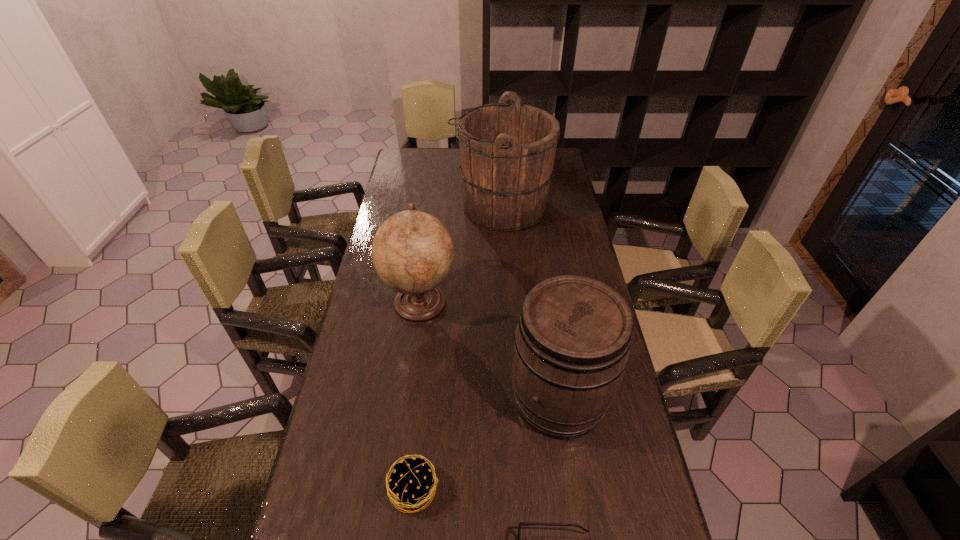
This screenshot has width=960, height=540. I want to click on vacant space that is in between the second farthest object and the tallest object, so click(x=461, y=254).

You are a GUI agent. You are given a task and a screenshot of the screen. Output one action in this format:
    pyautogui.click(x=<x>, y=<y>)
    Task: Click on the unoccupied position between the wine bucket and the fourth tallest object
    Image resolution: width=960 pixels, height=540 pixels.
    Given the screenshot: What is the action you would take?
    pyautogui.click(x=487, y=444)

The width and height of the screenshot is (960, 540). I want to click on the third closest object to the bucket, so click(412, 483).

Find the location of a particular element. object that ranks as the third closest to the third nearest object is located at coordinates (520, 523).

Locate an element on the screen. The width and height of the screenshot is (960, 540). vacant space that satisfies the following two spatial constraints: 1. on the front-facing side of the second shortest object; 2. on the right side of the globe is located at coordinates (396, 490).

Identify the location of free point that satisfies the following two spatial constraints: 1. on the front-facing side of the fourth nearest object; 2. on the right side of the third farthest object. The height and width of the screenshot is (540, 960). (407, 398).

You are a GUI agent. You are given a task and a screenshot of the screen. Output one action in this format:
    pyautogui.click(x=<x>, y=<y>)
    Task: Click on the vacant space that satisfies the following two spatial constraints: 1. on the back side of the second nearest object; 2. on the front-facing side of the globe
    Image resolution: width=960 pixels, height=540 pixels.
    Given the screenshot: What is the action you would take?
    pyautogui.click(x=433, y=301)

The height and width of the screenshot is (540, 960). I want to click on vacant space that satisfies the following two spatial constraints: 1. on the front-facing side of the globe; 2. on the right side of the third nearest object, so click(407, 398).

Locate an element on the screen. The image size is (960, 540). blank area in the image that satisfies the following two spatial constraints: 1. on the front-facing side of the fourth nearest object; 2. on the back side of the wine bucket is located at coordinates (407, 398).